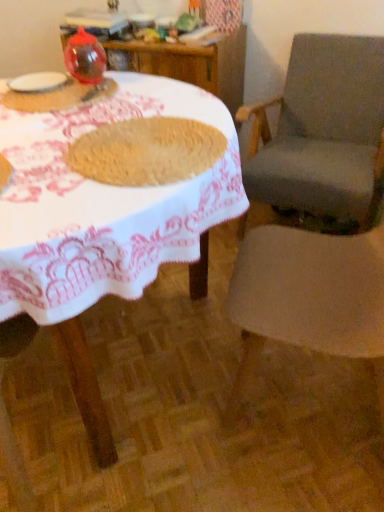
Image resolution: width=384 pixels, height=512 pixels. Identify the location of vacant area that lies between white matte plate at upper left, marked as the 2th tableware in a bottom-to-top arrangement, and transparent plastic balloon at upper left, which is counted as the 1th tableware, starting from the top. (76, 87).